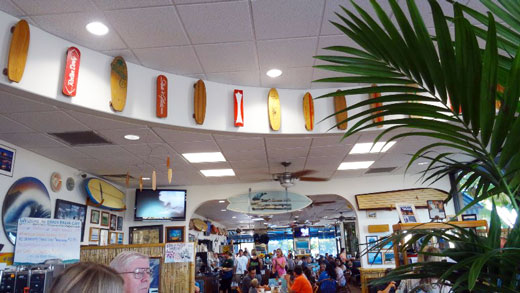
Locate an element on the screen. This screenshot has width=520, height=293. wall is located at coordinates (31, 165), (381, 182).